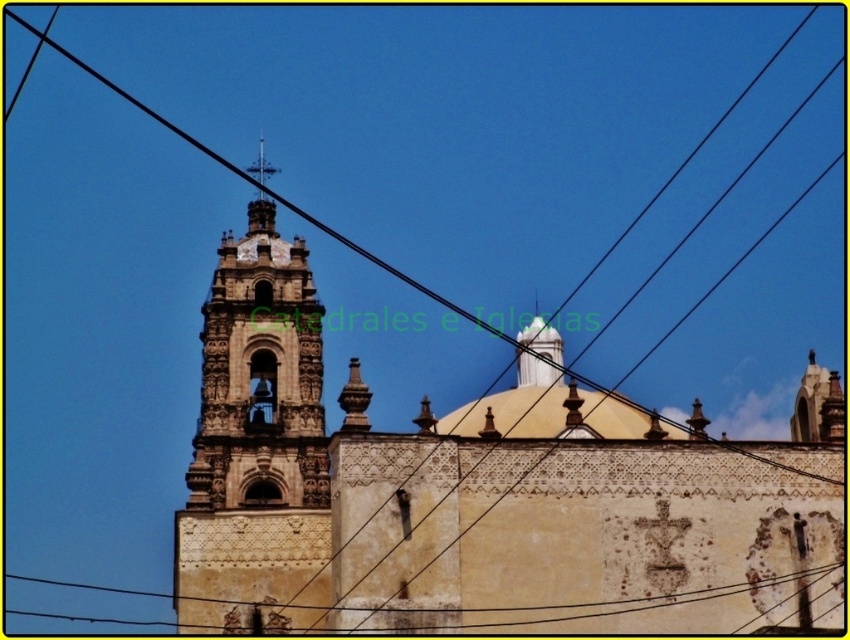
Can you confirm if black wire at upper center is positioned to the left of polished silver spire at upper center?

Incorrect, black wire at upper center is not on the left side of polished silver spire at upper center.

Based on the photo, does black wire at upper center have a larger size compared to polished silver spire at upper center?

Yes.

Does point (605, 236) lie behind point (268, 170)?

Yes, it is behind point (268, 170).

What are the coordinates of `black wire at upper center` in the screenshot? It's located at (541, 168).

Does black wire at upper center have a lesser height compared to yellow stucco church at center?

Incorrect, black wire at upper center's height does not fall short of yellow stucco church at center's.

Is point (809, 74) farther from viewer compared to point (541, 340)?

Yes, point (809, 74) is behind point (541, 340).

The width and height of the screenshot is (850, 640). I want to click on black wire at upper center, so click(x=541, y=168).

Is yellow stucco church at center to the left of polished silver spire at upper center from the viewer's perspective?

In fact, yellow stucco church at center is to the right of polished silver spire at upper center.

This screenshot has width=850, height=640. In order to click on yellow stucco church at center in this screenshot , I will do `click(482, 493)`.